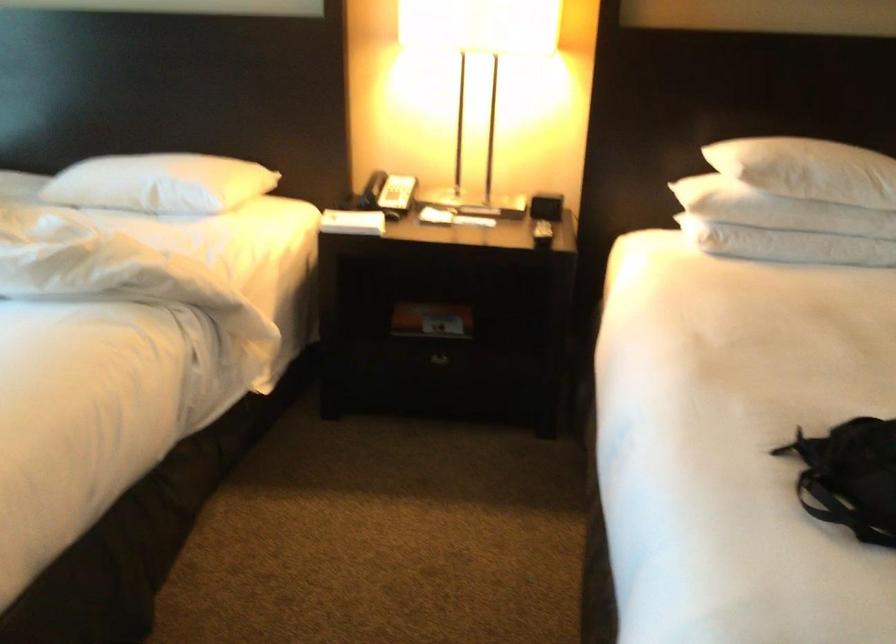
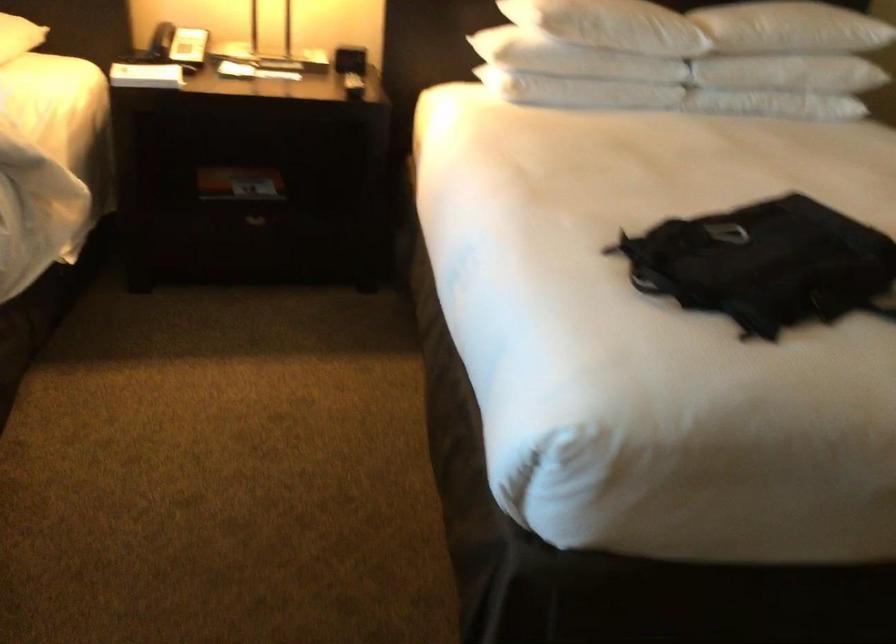
Question: The images are taken continuously from a first-person perspective. In which direction are you moving?

Choices:
 (A) Left
 (B) Right
 (C) Forward
 (D) Backward

Answer: (A)